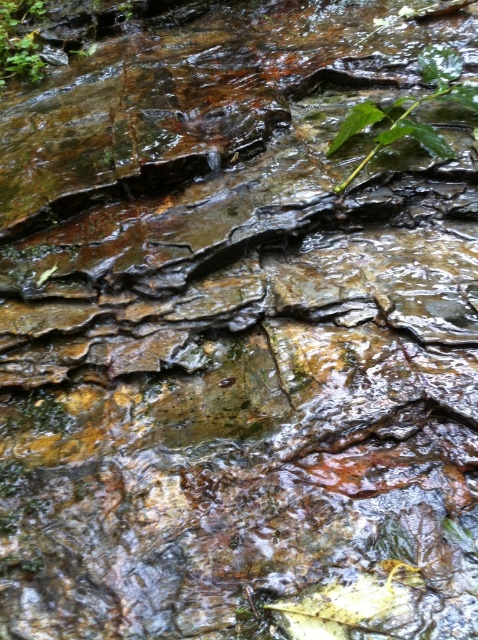
Is green leafy plant at upper right closer to camera compared to green leafy plant at upper left?

Yes, green leafy plant at upper right is in front of green leafy plant at upper left.

Can you confirm if green leafy plant at upper right is wider than green leafy plant at upper left?

Indeed, green leafy plant at upper right has a greater width compared to green leafy plant at upper left.

Does point (339, 138) lie behind point (23, 70)?

No, it is not.

Where is `green leafy plant at upper right`? The height and width of the screenshot is (640, 478). green leafy plant at upper right is located at coordinates (412, 108).